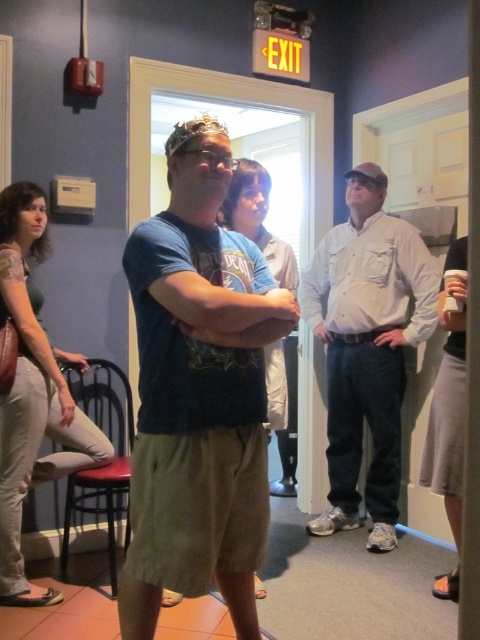
You are standing at the entrance of the room and want to move towards the gold metallic tiara at center. There is a red cushioned stool at lower left in your path. Do you need to go around it?

A: The red cushioned stool at lower left is 6.31 feet away from the gold metallic tiara at center, so you do not need to go around it since the distance is sufficient to walk straight towards the tiara without obstruction.